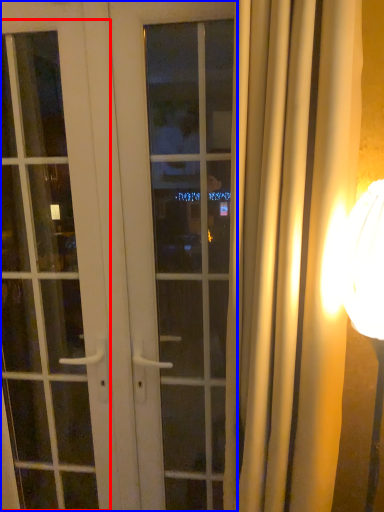
Question: Which object appears farthest to the camera in this image, screen door (highlighted by a red box) or door (highlighted by a blue box)?

Choices:
 (A) screen door
 (B) door

Answer: (A)